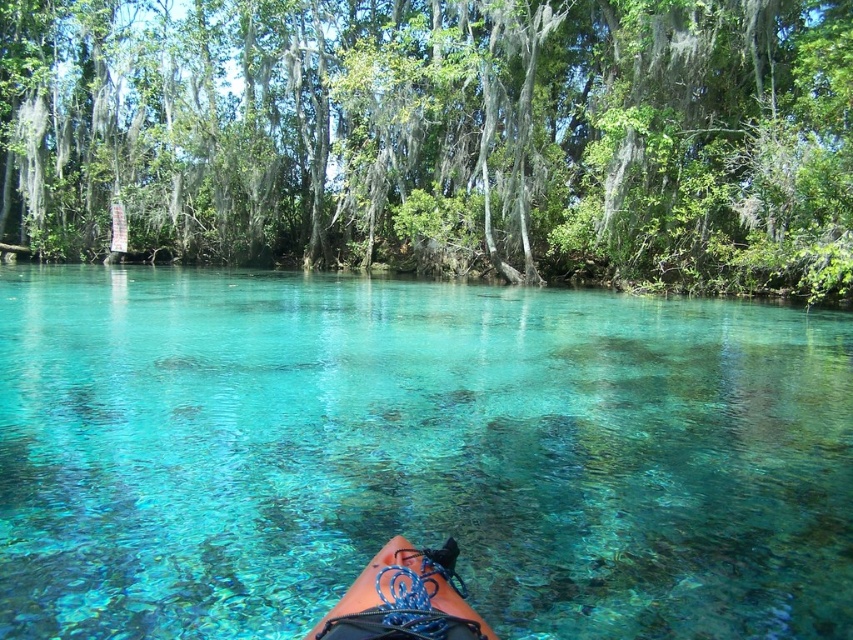
Question: Which point is closer to the camera taking this photo?

Choices:
 (A) (821, 529)
 (B) (374, 593)

Answer: (B)

Question: Is green leafy tree at upper center to the right of blue rubber canoe at lower center from the viewer's perspective?

Choices:
 (A) yes
 (B) no

Answer: (B)

Question: Which of the following is the closest to the observer?

Choices:
 (A) clear glassy water at center
 (B) blue rubber canoe at lower center

Answer: (B)

Question: Considering the real-world distances, which object is farthest from the green leafy tree at upper center?

Choices:
 (A) clear glassy water at center
 (B) blue rubber canoe at lower center

Answer: (B)

Question: Does clear glassy water at center appear under green leafy tree at upper center?

Choices:
 (A) no
 (B) yes

Answer: (B)

Question: Is the position of clear glassy water at center more distant than that of blue rubber canoe at lower center?

Choices:
 (A) no
 (B) yes

Answer: (B)